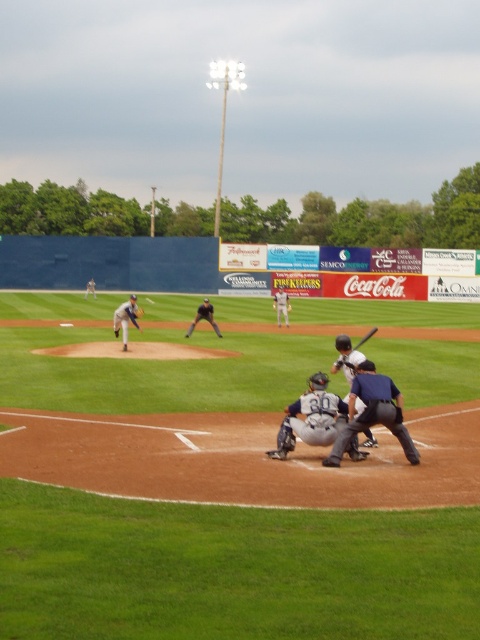
Question: Can you confirm if gray matte catcher at center is bigger than white jersey baseball player at center?

Choices:
 (A) no
 (B) yes

Answer: (A)

Question: Which object appears farthest from the camera in this image?

Choices:
 (A) black leather baseball glove at center
 (B) gray uniformed pitcher at center-left
 (C) white matte bat at center
 (D) white uniformed player at center

Answer: (D)

Question: Based on their relative distances, which object is farther from the dark gray leather glove at center?

Choices:
 (A) gray uniformed pitcher at center-left
 (B) white jersey baseball player at center
 (C) dark blue uniform at center

Answer: (C)

Question: Which object is closer to the camera taking this photo?

Choices:
 (A) gray matte catcher at center
 (B) black leather baseball glove at center
 (C) dark gray leather glove at center
 (D) white jersey baseball player at center

Answer: (A)

Question: Is gray matte catcher at center wider than gray uniformed pitcher at center-left?

Choices:
 (A) yes
 (B) no

Answer: (B)

Question: Does dark blue uniform at center have a greater width compared to gray uniformed pitcher at center-left?

Choices:
 (A) yes
 (B) no

Answer: (B)